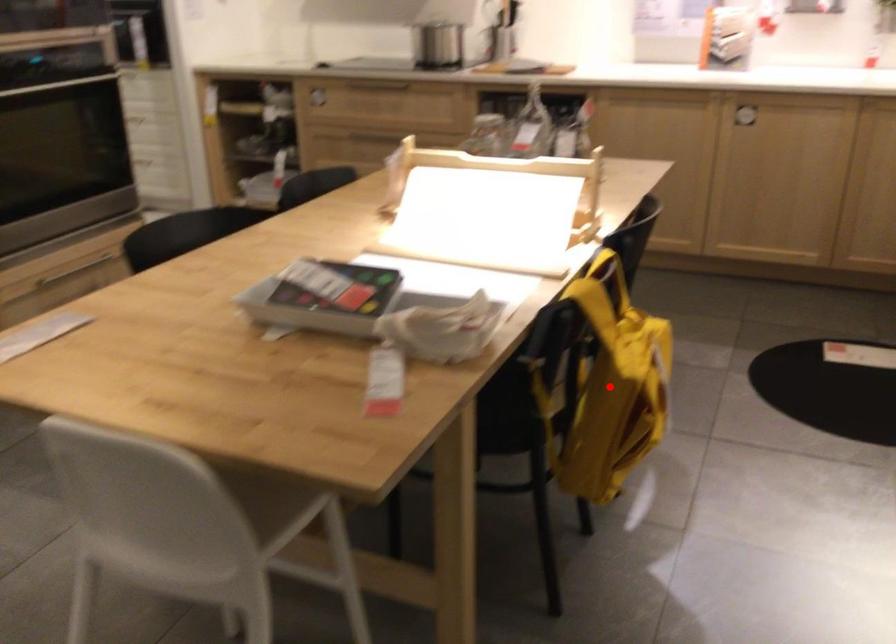
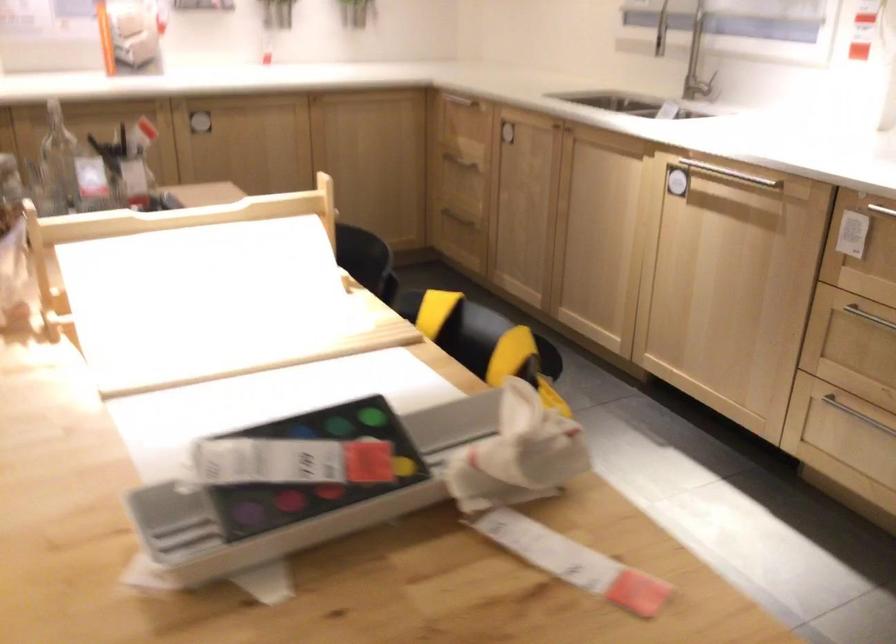
Question: I am providing you with two images of the same scene from different viewpoints. A red point is marked on the first image. Is the red point's position out of view in image 2?

Choices:
 (A) Yes
 (B) No

Answer: (A)